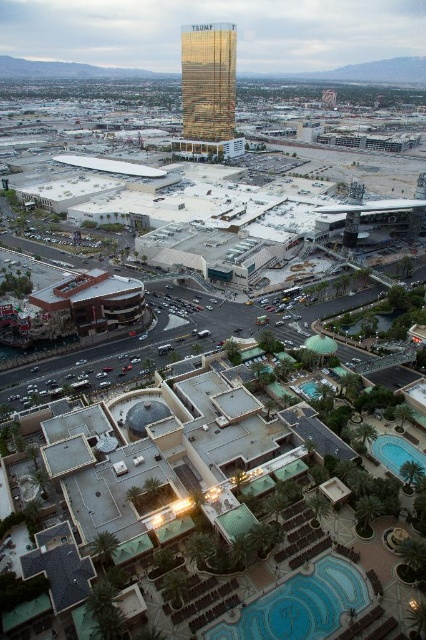
Question: Considering the relative positions of gold reflective building at center and red brick building at center in the image provided, where is gold reflective building at center located with respect to red brick building at center?

Choices:
 (A) right
 (B) left

Answer: (A)

Question: Is gold reflective building at center below red brick building at center?

Choices:
 (A) no
 (B) yes

Answer: (A)

Question: Among these objects, which one is farthest from the camera?

Choices:
 (A) red brick building at center
 (B) gold reflective building at center
 (C) blue glass pool at lower center
 (D) blue glossy pool at lower right

Answer: (B)

Question: Observing the image, what is the correct spatial positioning of blue glass pool at lower center in reference to red brick building at center?

Choices:
 (A) below
 (B) above

Answer: (A)

Question: Which of the following is the closest to the observer?

Choices:
 (A) blue glossy pool at lower right
 (B) gold reflective building at center
 (C) red brick building at center

Answer: (A)

Question: Among these points, which one is nearest to the camera?

Choices:
 (A) coord(399,444)
 (B) coord(317,593)
 (C) coord(104,321)
 (D) coord(232,100)

Answer: (B)